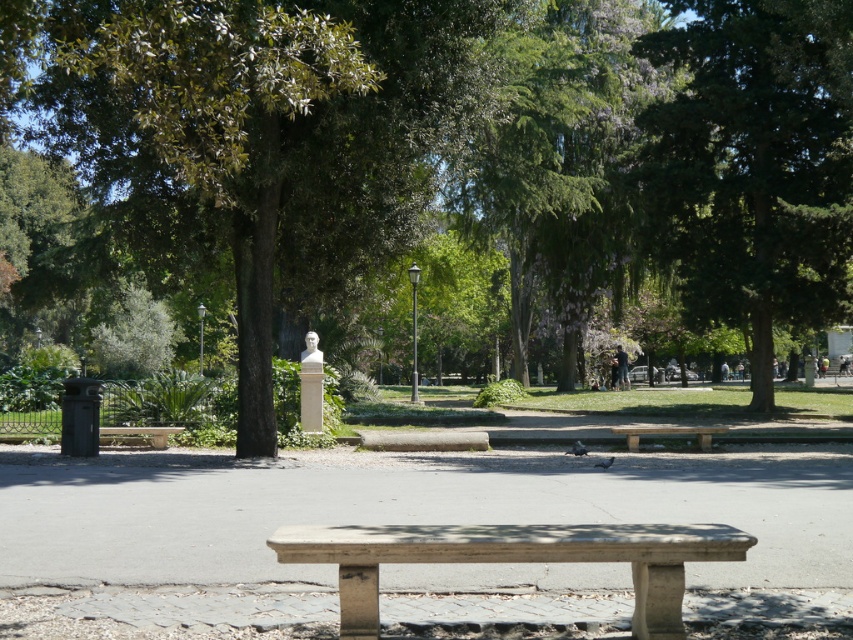
You are standing at the stone bench in the park and want to determine which of the two points, point (718, 545) or point (165, 444), is nearer to you. Based on the scene description, which point is closer?

Point (718, 545) is closer to the viewer than point (165, 444).

You are a park visitor who wants to know if the green leafy tree at upper right is wider than the stone bench at center. Can you confirm this?

The green leafy tree at upper right is wider than the stone bench at center, so yes, the tree is wider than the bench.